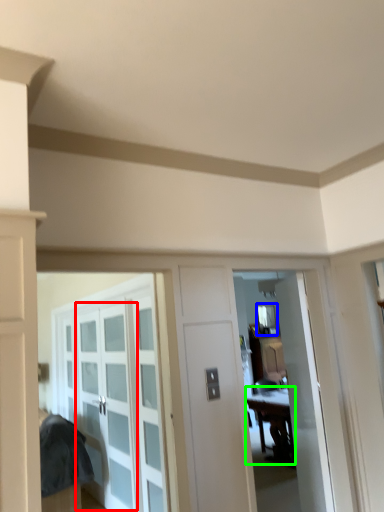
Question: Which is nearer to the glass door (highlighted by a red box)? window (highlighted by a blue box) or table (highlighted by a green box).

Choices:
 (A) window
 (B) table

Answer: (B)